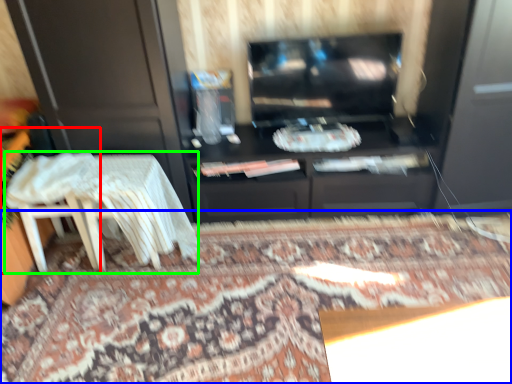
Question: Considering the real-world distances, which object is closest to chair (highlighted by a red box)? mat (highlighted by a blue box) or table (highlighted by a green box).

Choices:
 (A) mat
 (B) table

Answer: (B)